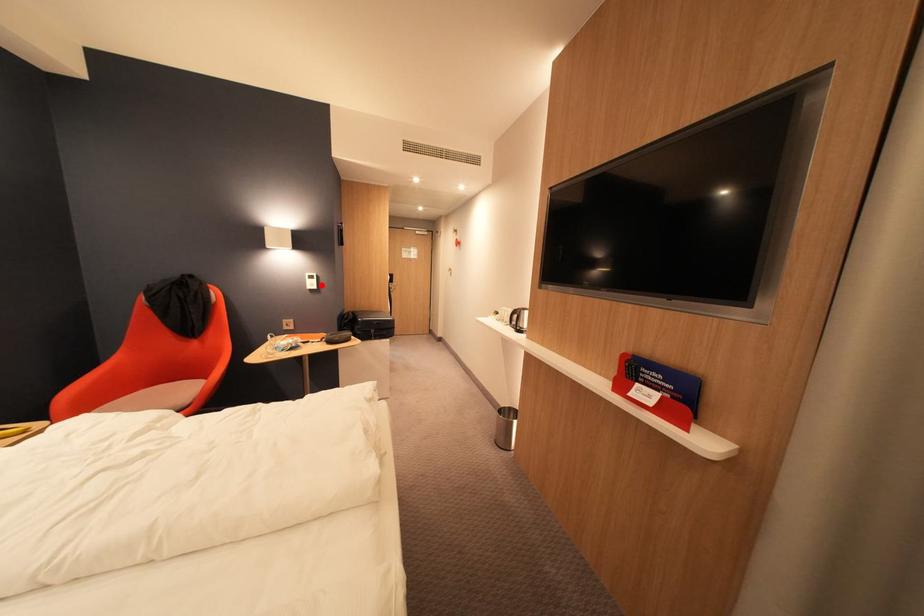
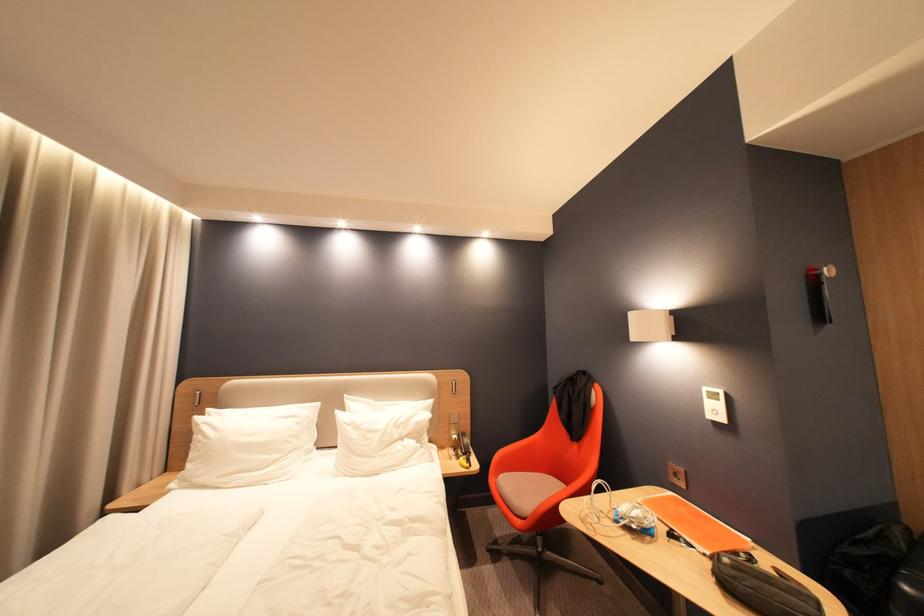
Question: I am providing you with two images of the same scene from different viewpoints. Image1 has a red point marked. In image2, the corresponding 3D location appears at what relative position? Reply with the corresponding letter.

Choices:
 (A) Closer
 (B) Farther

Answer: (B)